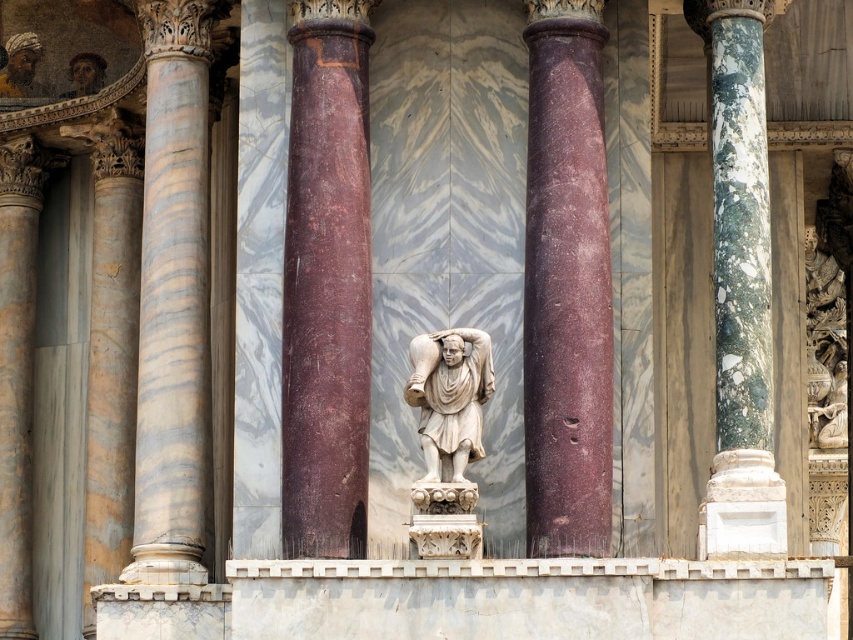
Question: Does marble column at center come behind marble column at left?

Choices:
 (A) no
 (B) yes

Answer: (A)

Question: Which object is closer to the camera taking this photo?

Choices:
 (A) marble column at center
 (B) marble column at left

Answer: (A)

Question: Estimate the real-world distances between objects in this image. Which object is farther from the green marble column at right?

Choices:
 (A) white marble statue at center
 (B) purple marble column at center
 (C) marble column at center
 (D) marble column at left

Answer: (D)

Question: Is purple marble column at center above marble column at left?

Choices:
 (A) no
 (B) yes

Answer: (B)

Question: Which of the following is the farthest from the observer?

Choices:
 (A) white marble statue at center
 (B) marble column at left
 (C) marble column at center
 (D) purple marble column at center

Answer: (B)

Question: Does purple marble column at center appear under green marble column at right?

Choices:
 (A) yes
 (B) no

Answer: (B)